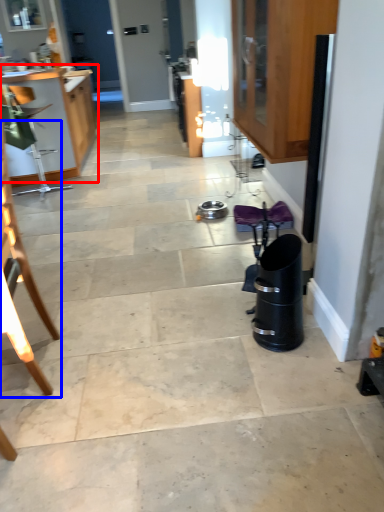
Question: Which object is closer to the camera taking this photo, cabinetry (highlighted by a red box) or chair (highlighted by a blue box)?

Choices:
 (A) cabinetry
 (B) chair

Answer: (B)